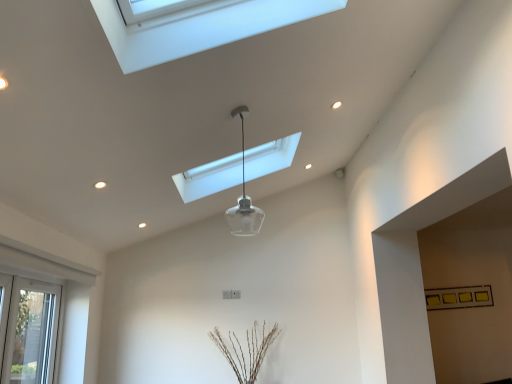
This screenshot has width=512, height=384. Describe the element at coordinates (34, 312) in the screenshot. I see `white plastic window at lower left` at that location.

How much space does transparent glass pendant light at center, the first lamp positioned from the front, occupy vertically?

transparent glass pendant light at center, the first lamp positioned from the front, is 27.86 inches in height.

Find the location of a particular element. This screenshot has height=384, width=512. white plastic window at lower left is located at coordinates (34, 312).

Is point (192, 181) closer to viewer compared to point (244, 111)?

That is False.

From the image's perspective, is transparent glass pendant light at center, the 1th lamp from the back, positioned above or below transparent glass pendant light at center, the 2th lamp viewed from the back?

Based on their image positions, transparent glass pendant light at center, the 1th lamp from the back, is located above transparent glass pendant light at center, the 2th lamp viewed from the back.

Which is more to the right, transparent glass pendant light at center, acting as the 2th lamp starting from the front, or transparent glass pendant light at center, the first lamp positioned from the front?

transparent glass pendant light at center, the first lamp positioned from the front.

Looking at the image, does transparent glass pendant light at center, the 1th lamp from the back, seem bigger or smaller compared to transparent glass pendant light at center, the 2th lamp viewed from the back?

Considering their sizes, transparent glass pendant light at center, the 1th lamp from the back, takes up more space than transparent glass pendant light at center, the 2th lamp viewed from the back.

Is transparent glass pendant light at center, the 1th lamp from the back, facing towards white plastic window at lower left?

No, transparent glass pendant light at center, the 1th lamp from the back, is not oriented towards white plastic window at lower left.

From a real-world perspective, between transparent glass pendant light at center, the 1th lamp from the back, and white plastic window at lower left, who is vertically higher?

transparent glass pendant light at center, the 1th lamp from the back, from a real-world perspective.

In the scene shown: From the image's perspective, who appears lower, transparent glass pendant light at center, acting as the 2th lamp starting from the front, or white plastic window at lower left?

white plastic window at lower left appears lower in the image.

Between transparent glass pendant light at center, the 1th lamp from the back, and white plastic window at lower left, which one has more height?

white plastic window at lower left is taller.

Is transparent glass pendant light at center, the first lamp positioned from the front, shorter than white plastic window at lower left?

Indeed, transparent glass pendant light at center, the first lamp positioned from the front, has a lesser height compared to white plastic window at lower left.

The image size is (512, 384). I want to click on the 1st lamp positioned above the white plastic window at lower left (from the image's perspective), so click(244, 198).

Which is in front, transparent glass pendant light at center, the first lamp positioned from the front, or white plastic window at lower left?

Positioned in front is transparent glass pendant light at center, the first lamp positioned from the front.

Based on their positions, is transparent glass pendant light at center, the first lamp positioned from the front, located to the left or right of white plastic window at lower left?

From the image, it's evident that transparent glass pendant light at center, the first lamp positioned from the front, is to the right of white plastic window at lower left.

Considering the relative sizes of white plastic window at lower left and transparent glass pendant light at center, the 2th lamp viewed from the back, in the image provided, is white plastic window at lower left smaller than transparent glass pendant light at center, the 2th lamp viewed from the back,?

No.

How distant is white plastic window at lower left from transparent glass pendant light at center, the first lamp positioned from the front?

The distance of white plastic window at lower left from transparent glass pendant light at center, the first lamp positioned from the front, is 6.03 feet.

Considering their positions, is white plastic window at lower left located in front of or behind transparent glass pendant light at center, the first lamp positioned from the front?

Visually, white plastic window at lower left is located behind transparent glass pendant light at center, the first lamp positioned from the front.

Who is shorter, white plastic window at lower left or transparent glass pendant light at center, the first lamp positioned from the front?

Standing shorter between the two is transparent glass pendant light at center, the first lamp positioned from the front.

Could you tell me if white plastic window at lower left is turned towards transparent glass pendant light at center, the 1th lamp from the back?

No, white plastic window at lower left is not oriented towards transparent glass pendant light at center, the 1th lamp from the back.

Which is more to the right, white plastic window at lower left or transparent glass pendant light at center, acting as the 2th lamp starting from the front?

Positioned to the right is transparent glass pendant light at center, acting as the 2th lamp starting from the front.

Can you confirm if white plastic window at lower left is thinner than transparent glass pendant light at center, the 1th lamp from the back?

Correct, the width of white plastic window at lower left is less than that of transparent glass pendant light at center, the 1th lamp from the back.

Considering their positions, is white plastic window at lower left located in front of or behind transparent glass pendant light at center, acting as the 2th lamp starting from the front?

Clearly, white plastic window at lower left is in front of transparent glass pendant light at center, acting as the 2th lamp starting from the front.

Would you say transparent glass pendant light at center, the first lamp positioned from the front, is to the left or to the right of transparent glass pendant light at center, acting as the 2th lamp starting from the front, in the picture?

Clearly, transparent glass pendant light at center, the first lamp positioned from the front, is on the right of transparent glass pendant light at center, acting as the 2th lamp starting from the front, in the image.

Considering the sizes of objects transparent glass pendant light at center, the 2th lamp viewed from the back, and transparent glass pendant light at center, the 1th lamp from the back, in the image provided, who is taller, transparent glass pendant light at center, the 2th lamp viewed from the back, or transparent glass pendant light at center, the 1th lamp from the back,?

Standing taller between the two is transparent glass pendant light at center, the 2th lamp viewed from the back.

Does transparent glass pendant light at center, the 2th lamp viewed from the back, have a lesser width compared to transparent glass pendant light at center, the 1th lamp from the back?

Yes.

This screenshot has height=384, width=512. In order to click on lamp that is above the transparent glass pendant light at center, the 2th lamp viewed from the back (from the image's perspective) in this screenshot , I will do `click(239, 176)`.

Find the location of a particular element. window lying below the transparent glass pendant light at center, the 1th lamp from the back (from the image's perspective) is located at coordinates (34, 312).

Considering their positions, is transparent glass pendant light at center, the first lamp positioned from the front, positioned closer to transparent glass pendant light at center, acting as the 2th lamp starting from the front, than white plastic window at lower left?

transparent glass pendant light at center, the first lamp positioned from the front.

Based on their spatial positions, is transparent glass pendant light at center, the first lamp positioned from the front, or transparent glass pendant light at center, acting as the 2th lamp starting from the front, closer to white plastic window at lower left?

transparent glass pendant light at center, acting as the 2th lamp starting from the front, lies closer to white plastic window at lower left than the other object.

Based on their spatial positions, is white plastic window at lower left or transparent glass pendant light at center, acting as the 2th lamp starting from the front, closer to transparent glass pendant light at center, the 2th lamp viewed from the back?

transparent glass pendant light at center, acting as the 2th lamp starting from the front, lies closer to transparent glass pendant light at center, the 2th lamp viewed from the back, than the other object.

From the image, which object appears to be nearer to transparent glass pendant light at center, the 2th lamp viewed from the back, transparent glass pendant light at center, acting as the 2th lamp starting from the front, or white plastic window at lower left?

The object closer to transparent glass pendant light at center, the 2th lamp viewed from the back, is transparent glass pendant light at center, acting as the 2th lamp starting from the front.

Which object lies further to the anchor point white plastic window at lower left, transparent glass pendant light at center, acting as the 2th lamp starting from the front, or transparent glass pendant light at center, the first lamp positioned from the front?

transparent glass pendant light at center, the first lamp positioned from the front, lies further to white plastic window at lower left than the other object.

Based on their spatial positions, is white plastic window at lower left or transparent glass pendant light at center, the first lamp positioned from the front, further from transparent glass pendant light at center, acting as the 2th lamp starting from the front?

white plastic window at lower left.

Locate an element on the screen. Image resolution: width=512 pixels, height=384 pixels. lamp between white plastic window at lower left and transparent glass pendant light at center, the 2th lamp viewed from the back, from left to right is located at coordinates (239, 176).